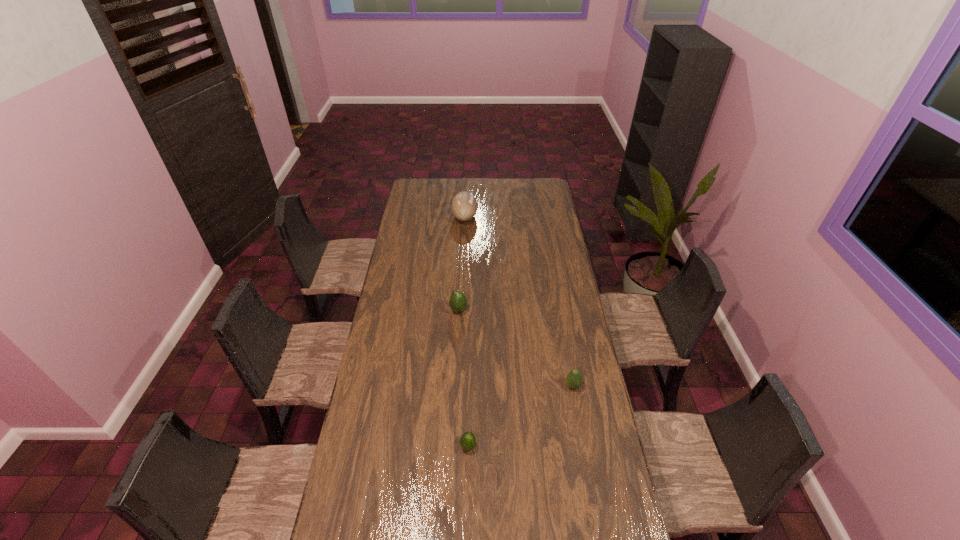
Where is `empty location between the rightmost avocado and the nearest avocado`? empty location between the rightmost avocado and the nearest avocado is located at coordinates (520, 416).

I want to click on vacant region between the farthest object and the rightmost avocado, so click(518, 301).

You are a GUI agent. You are given a task and a screenshot of the screen. Output one action in this format:
    pyautogui.click(x=<x>, y=<y>)
    Task: Click on the empty space between the farthest object and the rightmost object
    This screenshot has width=960, height=540.
    Given the screenshot: What is the action you would take?
    pyautogui.click(x=518, y=301)

This screenshot has height=540, width=960. In order to click on empty space that is in between the nearest object and the second farthest avocado in this screenshot , I will do `click(520, 416)`.

At what (x,y) coordinates should I click in order to perform the action: click on empty space between the third farthest object and the football (American). Please return your answer as a coordinate pair (x, y). Looking at the image, I should click on (518, 301).

Where is `free space between the tallest object and the farthest avocado`? The height and width of the screenshot is (540, 960). free space between the tallest object and the farthest avocado is located at coordinates (462, 264).

This screenshot has width=960, height=540. I want to click on object that can be found as the third closest to the rightmost avocado, so click(464, 206).

Locate which object ranks in proximity to the nearest object. Please provide its 2D coordinates. Your answer should be formatted as a tuple, i.e. [(x, y)], where the tuple contains the x and y coordinates of a point satisfying the conditions above.

[(574, 379)]

Find the location of a particular element. avocado identified as the closest to the third nearest object is located at coordinates (574, 379).

Image resolution: width=960 pixels, height=540 pixels. I want to click on avocado that is the second closest to the third nearest object, so click(468, 440).